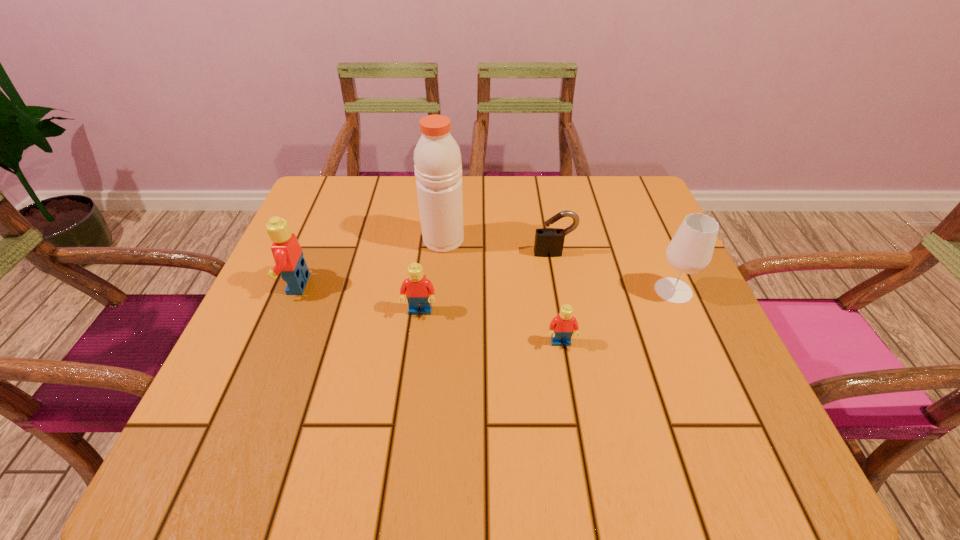
The image size is (960, 540). What are the coordinates of `vacant space located 0.070m on the face of the nearest Lego` in the screenshot? It's located at (567, 383).

Identify the location of free space located on the left of the shaker. The width and height of the screenshot is (960, 540). (352, 240).

Identify the location of blank area located 0.070m on the front of the glass. The height and width of the screenshot is (540, 960). (691, 332).

I want to click on vacant space situated with the keyhole on the front of the padlock, so click(562, 295).

Identify the location of object present at the far edge. (438, 168).

This screenshot has width=960, height=540. I want to click on object located at the left edge, so click(288, 255).

At what (x,y) coordinates should I click in order to perform the action: click on object present at the right edge. Please return your answer as a coordinate pair (x, y). Looking at the image, I should click on (690, 251).

Locate an element on the screen. Image resolution: width=960 pixels, height=540 pixels. free space at the far edge of the desktop is located at coordinates (467, 213).

At what (x,y) coordinates should I click in order to perform the action: click on vacant space at the near edge of the desktop. Please return your answer as a coordinate pair (x, y). Looking at the image, I should click on (608, 395).

The image size is (960, 540). Find the location of `free region at the left edge of the desktop`. free region at the left edge of the desktop is located at coordinates (332, 236).